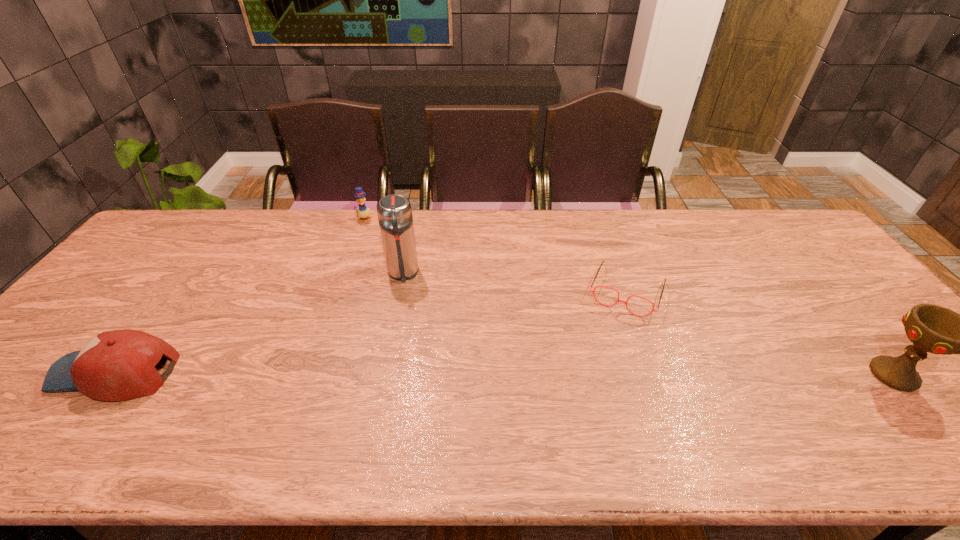
Find the location of a particular element. The width and height of the screenshot is (960, 540). baseball cap that is at the near edge is located at coordinates (118, 365).

The height and width of the screenshot is (540, 960). I want to click on chalice situated at the near edge, so click(x=931, y=328).

You are a GUI agent. You are given a task and a screenshot of the screen. Output one action in this format:
    pyautogui.click(x=<x>, y=<y>)
    Task: Click on the object that is at the left edge
    This screenshot has width=960, height=540.
    Given the screenshot: What is the action you would take?
    pyautogui.click(x=118, y=365)

This screenshot has width=960, height=540. I want to click on object present at the right edge, so pos(931,328).

What are the coordinates of `object that is at the near left corner` in the screenshot? It's located at (118, 365).

Locate an element on the screen. The height and width of the screenshot is (540, 960). object that is at the near right corner is located at coordinates (931, 328).

In the image, there is a desktop. Identify the location of free region at the far edge. (311, 247).

Image resolution: width=960 pixels, height=540 pixels. In the image, there is a desktop. What are the coordinates of `vacant area at the right edge` in the screenshot? It's located at (837, 333).

In order to click on vacant region between the farthest object and the leftmost object in this screenshot , I will do `click(240, 296)`.

You are a GUI agent. You are given a task and a screenshot of the screen. Output one action in this format:
    pyautogui.click(x=<x>, y=<y>)
    Task: Click on the vacant area that lies between the duckling and the second tallest object
    The image size is (960, 540).
    Given the screenshot: What is the action you would take?
    pyautogui.click(x=629, y=297)